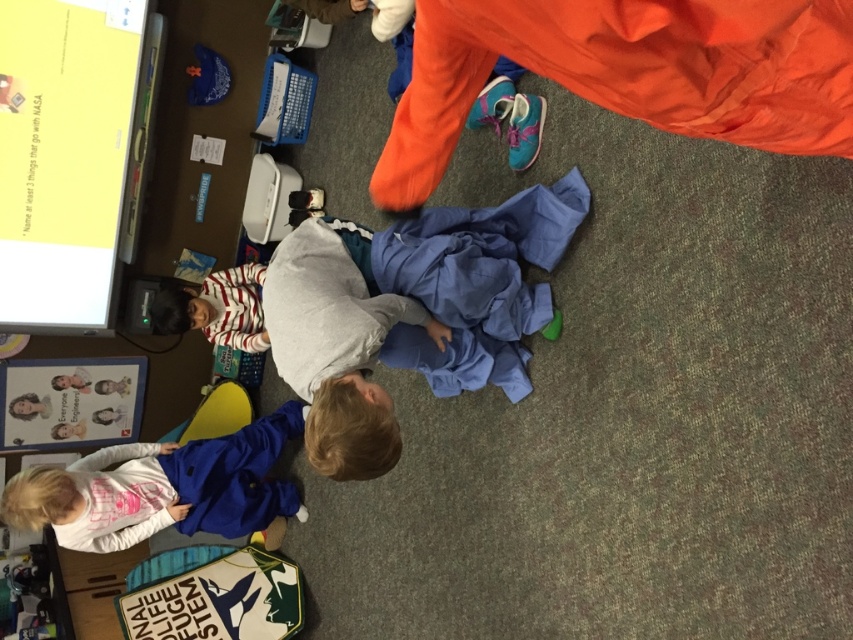
Between gray soft shirt at center and blue fabric jacket at lower left, which one is positioned lower?

blue fabric jacket at lower left is lower down.

Does gray soft shirt at center appear on the right side of blue fabric jacket at lower left?

Yes, gray soft shirt at center is to the right of blue fabric jacket at lower left.

The height and width of the screenshot is (640, 853). I want to click on gray soft shirt at center, so click(x=337, y=342).

Where is `gray soft shirt at center`? The width and height of the screenshot is (853, 640). gray soft shirt at center is located at coordinates (337, 342).